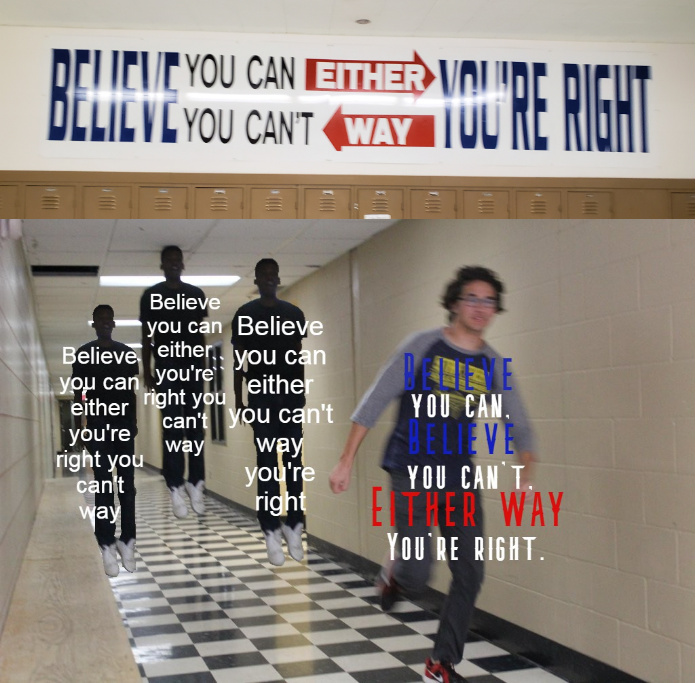
Find the location of a particular element. This screenshot has width=696, height=683. checkered floor is located at coordinates (235, 623).